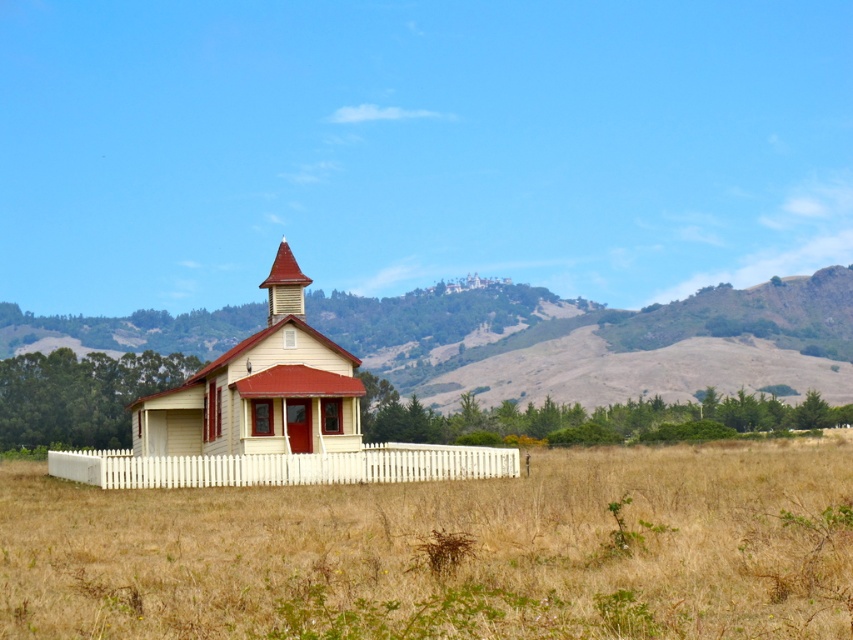
You are standing in front of the building and want to walk towards the dry grass at center. Which direction should you walk relative to the light yellow wood church at center?

The dry grass at center is below the light yellow wood church at center, so you should walk downward towards the dry grass at center.

You are standing in front of the building and want to take a photo that includes both the rugged brown hillside at center and the shiny red wood spire at center. Which object should you position closer to the left side of your camera frame to capture both in the shot?

The rugged brown hillside at center is positioned on the left side of the shiny red wood spire at center, so to include both in your photo, position the rugged brown hillside at center closer to the left side of your camera frame.

You are standing in front of the light yellow wood church at center and want to walk towards the rugged brown hillside at center. Which direction should you face to walk directly towards it?

The rugged brown hillside at center is positioned on the left side of the light yellow wood church at center, so you should face to the left to walk directly towards it.